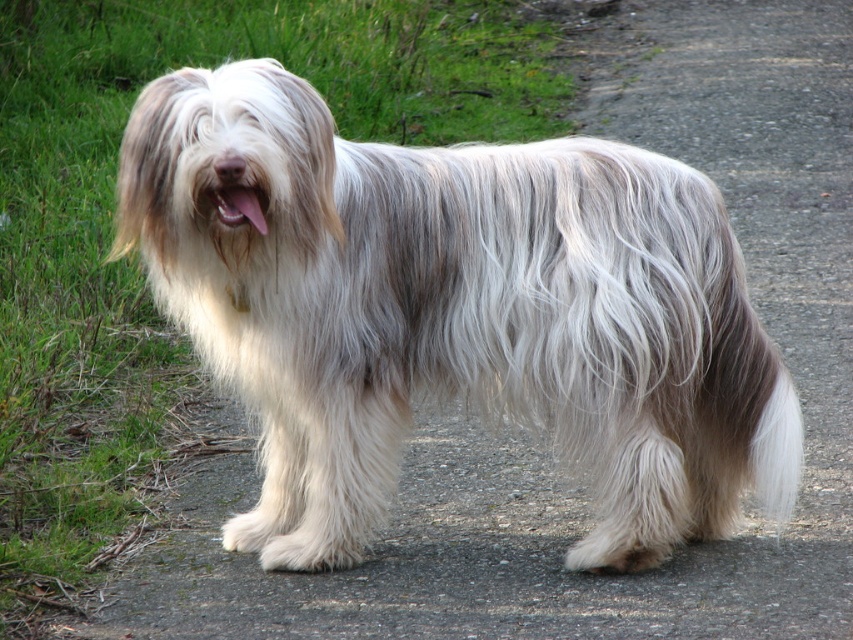
Question: Does white fluffy tail at lower right have a lesser width compared to pink fur at center?

Choices:
 (A) yes
 (B) no

Answer: (B)

Question: Does fuzzy white dog at center appear under pink fur at center?

Choices:
 (A) yes
 (B) no

Answer: (A)

Question: Is fuzzy white dog at center above white fluffy tail at lower right?

Choices:
 (A) no
 (B) yes

Answer: (B)

Question: Based on their relative distances, which object is farther from the fuzzy white dog at center?

Choices:
 (A) pink fur at center
 (B) white fluffy tail at lower right

Answer: (A)

Question: Which is farther from the fuzzy white dog at center?

Choices:
 (A) pink fur at center
 (B) white fluffy tail at lower right

Answer: (A)

Question: Among these objects, which one is farthest from the camera?

Choices:
 (A) fuzzy white dog at center
 (B) white fluffy tail at lower right

Answer: (B)